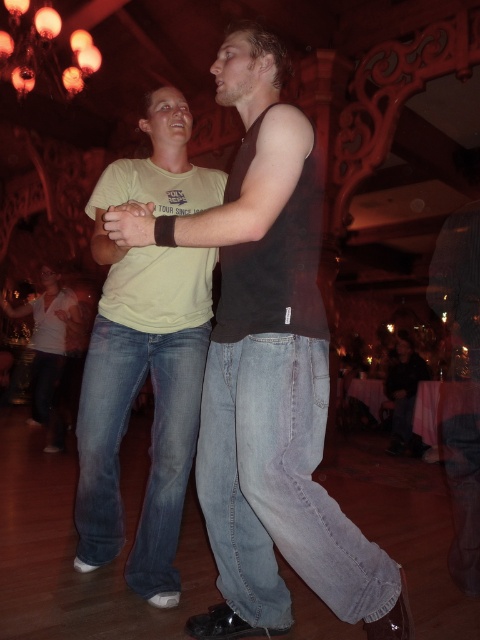
Which is below, matte black tank top at center or dark gray jeans at lower right?

Positioned lower is dark gray jeans at lower right.

Does matte black tank top at center have a lesser height compared to dark gray jeans at lower right?

No, matte black tank top at center is not shorter than dark gray jeans at lower right.

From the picture: Measure the distance between point (156,262) and camera.

The distance of point (156,262) from camera is 6.63 feet.

This screenshot has height=640, width=480. In order to click on matte black tank top at center in this screenshot , I will do `click(145, 355)`.

Looking at this image, who is positioned more to the left, dark brown tank top at center or white matte shirt at lower left?

white matte shirt at lower left

Can you confirm if dark brown tank top at center is positioned to the right of white matte shirt at lower left?

Indeed, dark brown tank top at center is positioned on the right side of white matte shirt at lower left.

Which is in front, point (288, 278) or point (36, 298)?

Positioned in front is point (288, 278).

Image resolution: width=480 pixels, height=640 pixels. I want to click on dark brown tank top at center, so click(x=269, y=374).

Is white matte shirt at lower left further to camera compared to dark gray jeans at lower right?

No, white matte shirt at lower left is in front of dark gray jeans at lower right.

Who is more distant from viewer, (47, 316) or (397, 340)?

The point (397, 340) is more distant.

At what (x,y) coordinates should I click in order to perform the action: click on white matte shirt at lower left. Please return your answer as a coordinate pair (x, y). The height and width of the screenshot is (640, 480). Looking at the image, I should click on [49, 349].